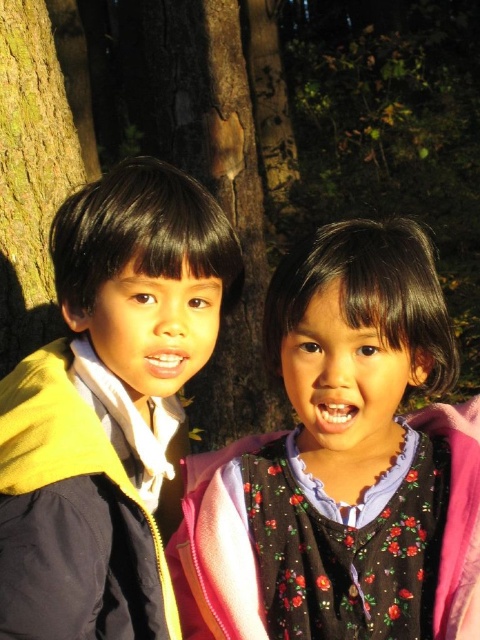
You are a photographer trying to capture a closeup of the green rough bark at left without including the yellow matte jacket at left in the frame. Based on their positions, is this possible?

The yellow matte jacket at left is below the green rough bark at left, so if you position the camera to focus on the upper part of the green rough bark at left while avoiding the lower area where the jacket is located, it should be possible to exclude the jacket from the frame.